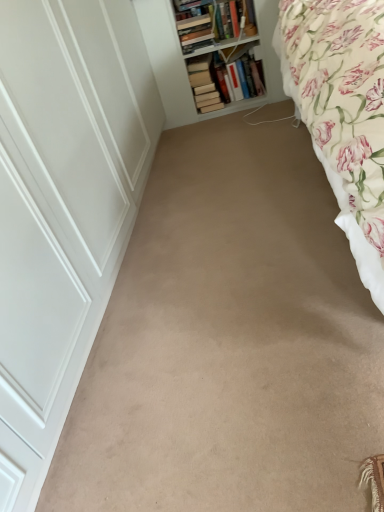
The width and height of the screenshot is (384, 512). Find the location of `free point above hardcover book at upper center, which appears as the first book when viewed from the right (from a real-world perspective)`. free point above hardcover book at upper center, which appears as the first book when viewed from the right (from a real-world perspective) is located at coordinates (240, 53).